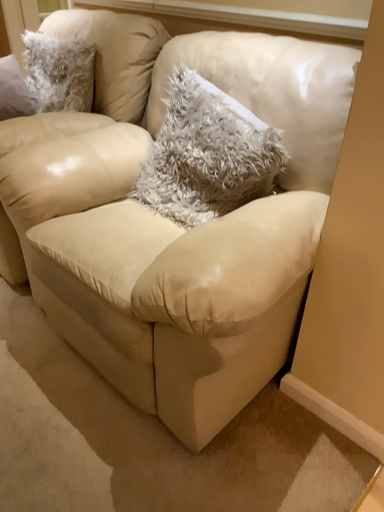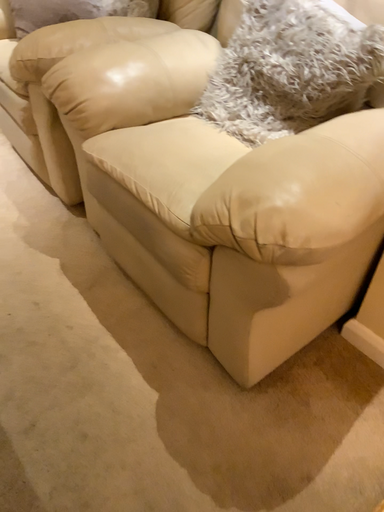
Question: Which way did the camera rotate in the video?

Choices:
 (A) rotated upward
 (B) rotated downward

Answer: (B)